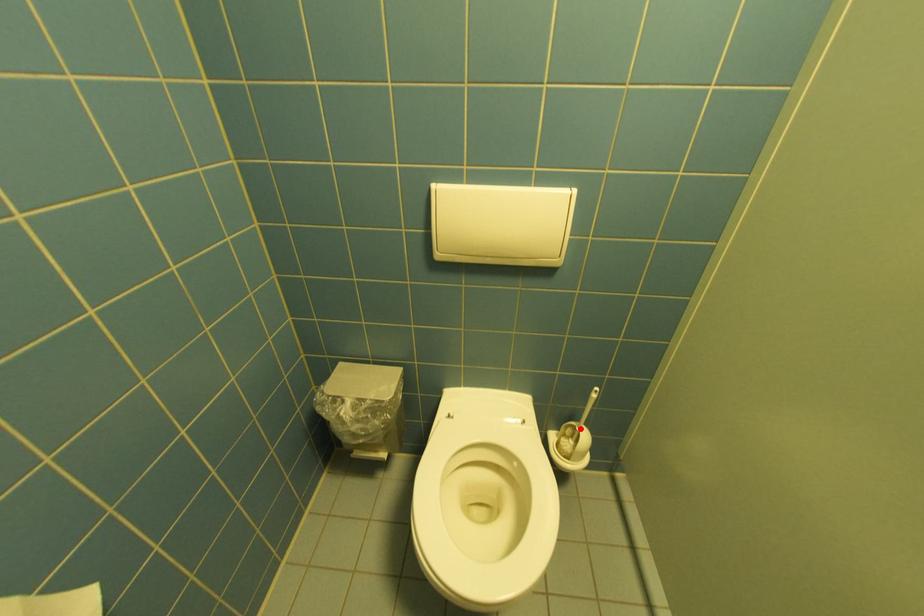
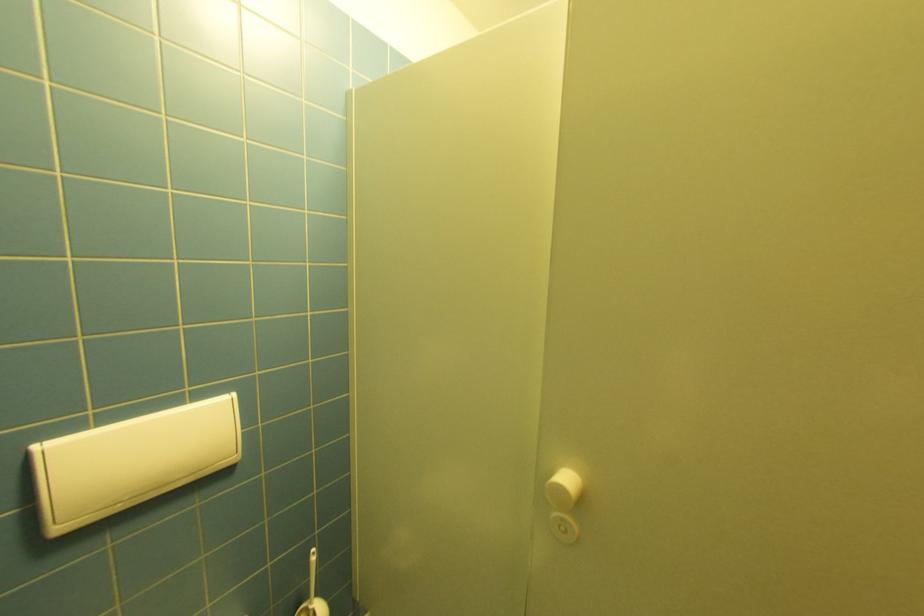
Question: I am providing you with two images of the same scene from different viewpoints. Given a red point in image1, look at the same physical point in image2. Is it:

Choices:
 (A) Closer to the viewpoint
 (B) Farther from the viewpoint

Answer: (A)